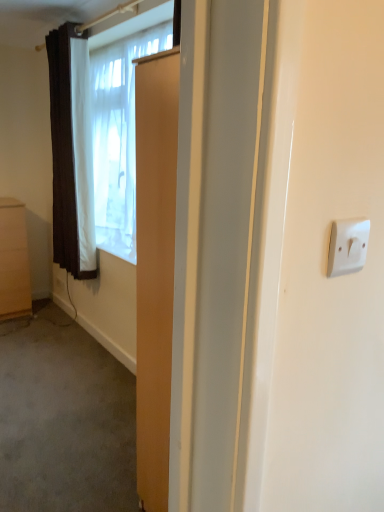
Question: From a real-world perspective, does brown textured curtain at left stand above white sheer curtain at upper left?

Choices:
 (A) yes
 (B) no

Answer: (B)

Question: Does brown textured curtain at left have a lesser width compared to white sheer curtain at upper left?

Choices:
 (A) yes
 (B) no

Answer: (A)

Question: Is brown textured curtain at left shorter than white sheer curtain at upper left?

Choices:
 (A) yes
 (B) no

Answer: (B)

Question: From the image's perspective, is brown textured curtain at left above white sheer curtain at upper left?

Choices:
 (A) yes
 (B) no

Answer: (A)

Question: Is brown textured curtain at left wider than white sheer curtain at upper left?

Choices:
 (A) no
 (B) yes

Answer: (A)

Question: Is matte brown cabinet at left situated inside brown textured curtain at left or outside?

Choices:
 (A) inside
 (B) outside

Answer: (B)

Question: Would you say matte brown cabinet at left is to the left or to the right of brown textured curtain at left in the picture?

Choices:
 (A) right
 (B) left

Answer: (B)

Question: Is matte brown cabinet at left taller or shorter than brown textured curtain at left?

Choices:
 (A) tall
 (B) short

Answer: (B)

Question: Looking at their shapes, would you say matte brown cabinet at left is wider or thinner than brown textured curtain at left?

Choices:
 (A) thin
 (B) wide

Answer: (B)

Question: Considering the positions of white sheer curtain at upper left and matte brown cabinet at left in the image, is white sheer curtain at upper left wider or thinner than matte brown cabinet at left?

Choices:
 (A) thin
 (B) wide

Answer: (A)

Question: From a real-world perspective, is white sheer curtain at upper left above or below matte brown cabinet at left?

Choices:
 (A) above
 (B) below

Answer: (A)

Question: From the image's perspective, is white sheer curtain at upper left positioned above or below matte brown cabinet at left?

Choices:
 (A) above
 (B) below

Answer: (A)

Question: Considering the positions of white sheer curtain at upper left and matte brown cabinet at left in the image, is white sheer curtain at upper left bigger or smaller than matte brown cabinet at left?

Choices:
 (A) big
 (B) small

Answer: (A)

Question: Relative to brown textured curtain at left, is white sheer curtain at upper left in front or behind?

Choices:
 (A) front
 (B) behind

Answer: (A)

Question: From the image's perspective, is white sheer curtain at upper left located above or below brown textured curtain at left?

Choices:
 (A) above
 (B) below

Answer: (B)